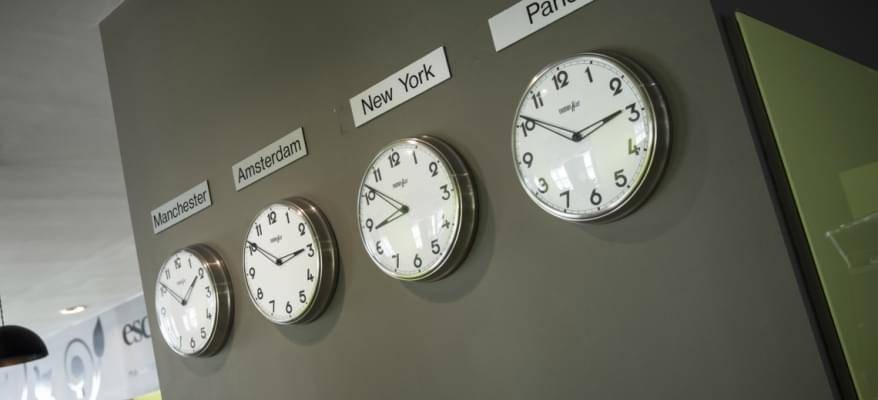
What are the coordinates of `clocks` in the screenshot? It's located at (178, 318), (267, 250), (421, 257), (571, 147).